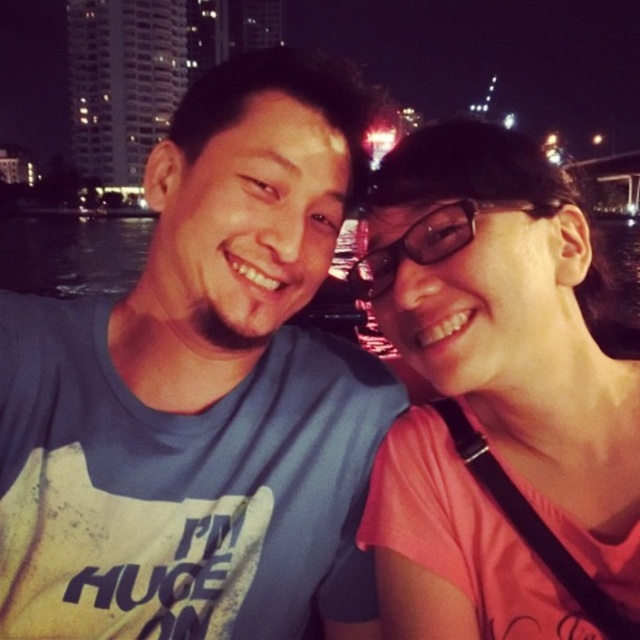
Question: Which object is the farthest from the blue cotton t-shirt at center?

Choices:
 (A) transparent plastic glasses at center
 (B) pink matte shirt at upper right

Answer: (A)

Question: Estimate the real-world distances between objects in this image. Which object is closer to the blue cotton t-shirt at center?

Choices:
 (A) transparent plastic glasses at center
 (B) pink matte shirt at upper right

Answer: (B)

Question: Does pink matte shirt at upper right have a larger size compared to transparent plastic glasses at center?

Choices:
 (A) no
 (B) yes

Answer: (A)

Question: Is pink matte shirt at upper right thinner than transparent plastic glasses at center?

Choices:
 (A) no
 (B) yes

Answer: (A)

Question: Can you confirm if pink matte shirt at upper right is positioned above transparent plastic glasses at center?

Choices:
 (A) yes
 (B) no

Answer: (B)

Question: Which object appears farthest from the camera in this image?

Choices:
 (A) pink matte shirt at upper right
 (B) blue cotton t-shirt at center

Answer: (B)